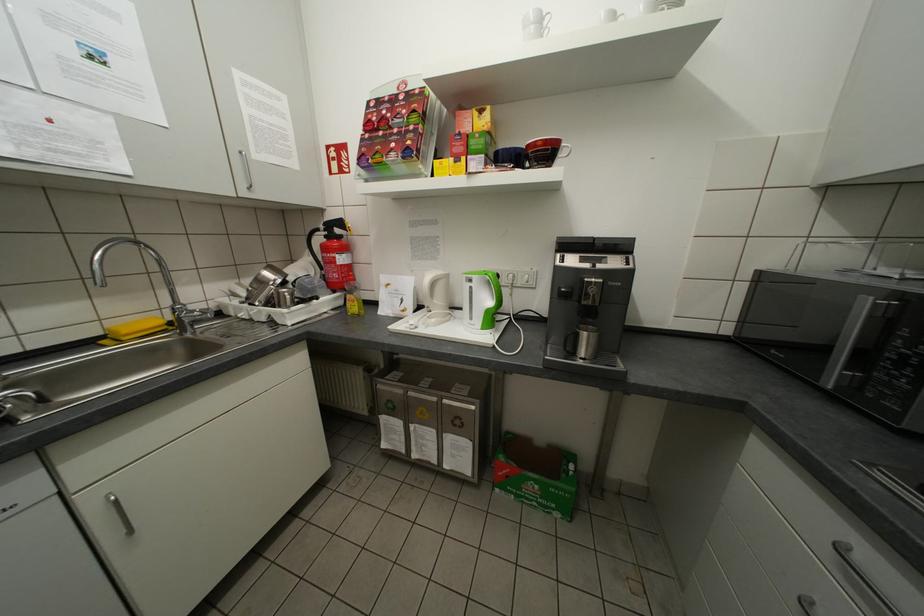
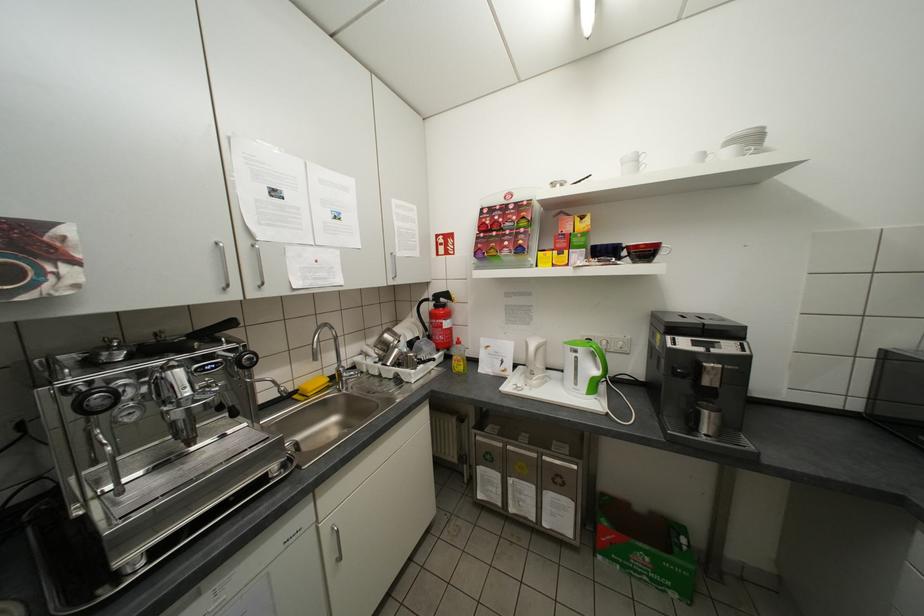
Where in the second image is the point corresponding to (132,331) from the first image?

(319, 389)